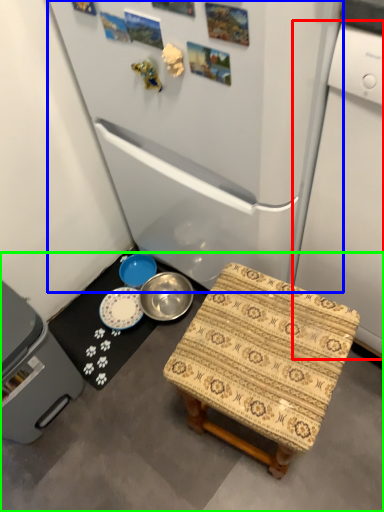
Question: Which object is the farthest from appliance (highlighted by a red box)? Choose among these: refrigerator (highlighted by a blue box) or concrete (highlighted by a green box).

Choices:
 (A) refrigerator
 (B) concrete

Answer: (B)